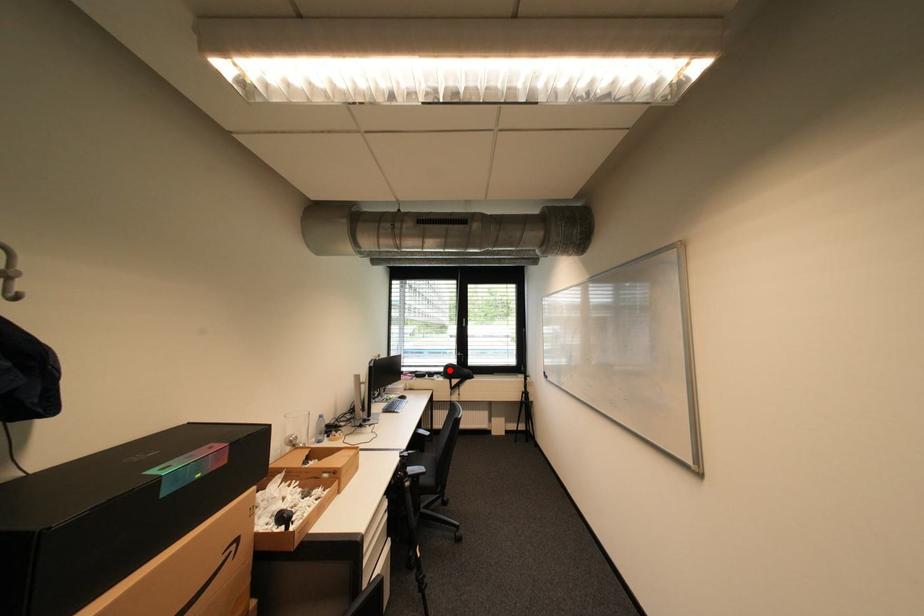
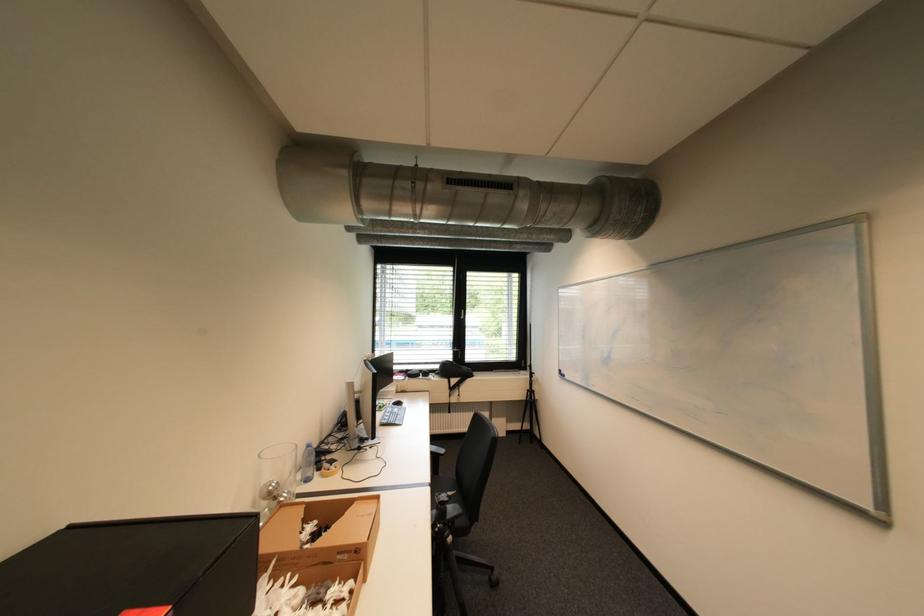
Find the pixel in the second image that matches the highlighted location in the first image.

(445, 368)